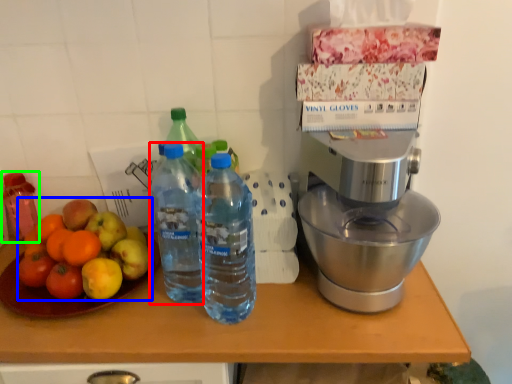
Question: Which is farther away from bottle (highlighted by a red box)? apple (highlighted by a blue box) or bottle (highlighted by a green box)?

Choices:
 (A) apple
 (B) bottle

Answer: (B)